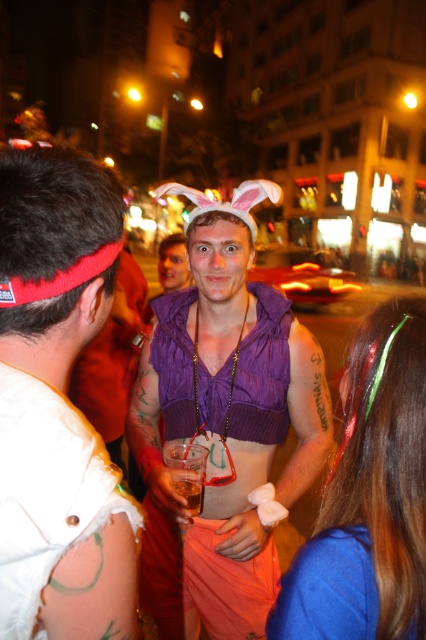
You are standing in the middle of the street and see two points in the scene. Which point is closer to you, point [199,273] or point [172,474]?

Point [172,474] is closer to you because it is less further to the camera than point [199,273].

You are a photographer at the event and want to capture both the purple knitted vest at center and the shiny blue hairband at center in a single photo. Which object should you focus on first to ensure both are in frame?

You should focus on the purple knitted vest at center first since it is larger than the shiny blue hairband at center, ensuring it fits within the frame while still capturing the smaller hairband.

Based on the photo, you are a photographer at the event and want to capture a closeup of the shiny blue hairband at center and the translucent plastic cup at center. Which object should you focus on if you want the one that is wider to be in sharp focus?

The shiny blue hairband at center might be wider than translucent plastic cup at center, so focus on the shiny blue hairband at center to ensure it is in sharp focus.